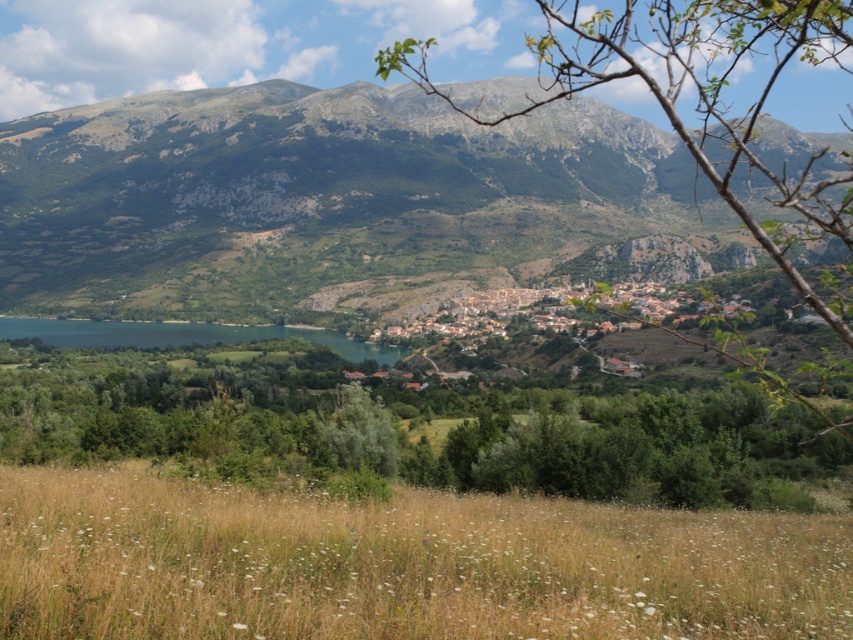
Which is more to the left, green textured mountain at upper center or blue water at lower left?

Positioned to the left is blue water at lower left.

Is the position of green textured mountain at upper center less distant than that of blue water at lower left?

No, green textured mountain at upper center is behind blue water at lower left.

You are a GUI agent. You are given a task and a screenshot of the screen. Output one action in this format:
    pyautogui.click(x=<x>, y=<y>)
    Task: Click on the green textured mountain at upper center
    This screenshot has height=640, width=853.
    Given the screenshot: What is the action you would take?
    pyautogui.click(x=317, y=196)

At what (x,y) coordinates should I click in order to perform the action: click on green textured mountain at upper center. Please return your answer as a coordinate pair (x, y). Looking at the image, I should click on (317, 196).

Who is taller, green textured mountain at upper center or brown stone village at center?

Standing taller between the two is green textured mountain at upper center.

Which is in front, point (590, 99) or point (555, 292)?

Point (555, 292) is more forward.

Find the location of a particular element. The height and width of the screenshot is (640, 853). green textured mountain at upper center is located at coordinates (317, 196).

Measure the distance between point (624,307) and camera.

Point (624,307) and camera are 18.48 meters apart.

Find the location of a particular element. The width and height of the screenshot is (853, 640). brown stone village at center is located at coordinates (538, 310).